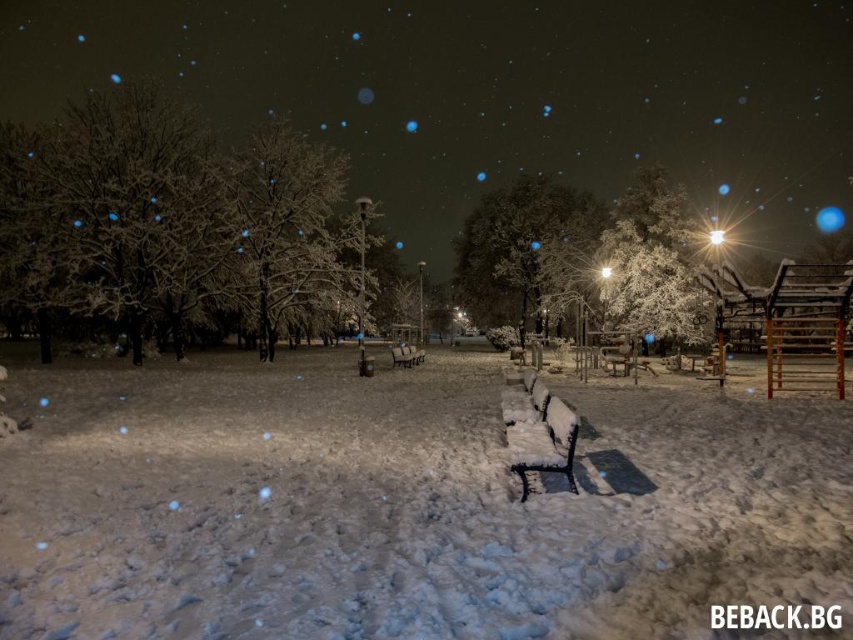
Question: Is snow-covered metal bench at center closer to the viewer compared to wooden bench at center?

Choices:
 (A) yes
 (B) no

Answer: (A)

Question: Estimate the real-world distances between objects in this image. Which object is farther from the snow-covered tree at left?

Choices:
 (A) snow-covered metal bench at center
 (B) white fluffy snow at center

Answer: (A)

Question: Is snow-covered tree at left above snow-covered metal bench at center?

Choices:
 (A) yes
 (B) no

Answer: (A)

Question: Is snow-covered metal bench at center bigger than wooden bench at center?

Choices:
 (A) yes
 (B) no

Answer: (B)

Question: Which point is farther to the camera?

Choices:
 (A) (535, 301)
 (B) (625, 600)
 (C) (701, 316)

Answer: (A)

Question: Which of these objects is positioned closest to the white frosty tree at right?

Choices:
 (A) wooden bench at center
 (B) snow-covered tree at left
 (C) snow-covered tree at center
 (D) snow-covered metal bench at center

Answer: (C)